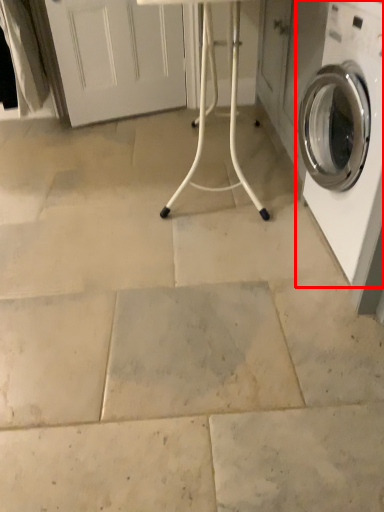
Question: From the image, what is the correct spatial relationship of washing machine (annotated by the red box) in relation to table?

Choices:
 (A) right
 (B) left

Answer: (A)